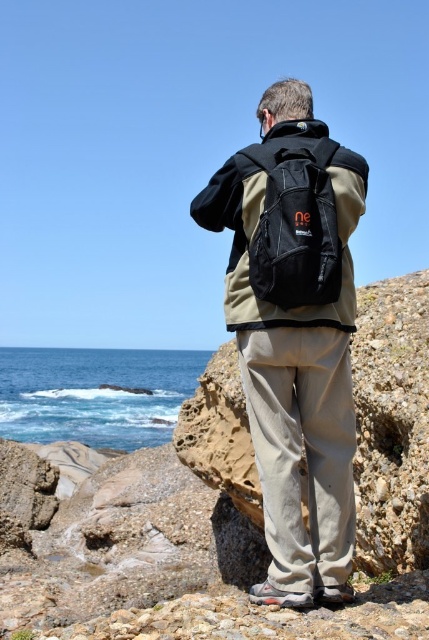
Does black matte backpack at center appear over black fabric backpack at center?

Incorrect, black matte backpack at center is not positioned above black fabric backpack at center.

In the scene shown: Who is positioned more to the left, black matte backpack at center or black fabric backpack at center?

Positioned to the left is black fabric backpack at center.

Where is `black matte backpack at center`? black matte backpack at center is located at coordinates (295, 333).

This screenshot has width=429, height=640. What are the coordinates of `black matte backpack at center` in the screenshot? It's located at (295, 333).

Can you confirm if black matte backpack at center is positioned to the right of blue water at lower left?

Yes, black matte backpack at center is to the right of blue water at lower left.

Is black matte backpack at center above blue water at lower left?

Indeed, black matte backpack at center is positioned over blue water at lower left.

Does point (277, 170) lie in front of point (157, 358)?

Yes, it is in front of point (157, 358).

Find the location of a particular element. This screenshot has height=640, width=429. black matte backpack at center is located at coordinates (295, 333).

Who is lower down, blue water at lower left or black fabric backpack at center?

blue water at lower left

Who is more forward, (141, 417) or (341, 248)?

Point (341, 248) is in front.

This screenshot has height=640, width=429. I want to click on blue water at lower left, so click(94, 394).